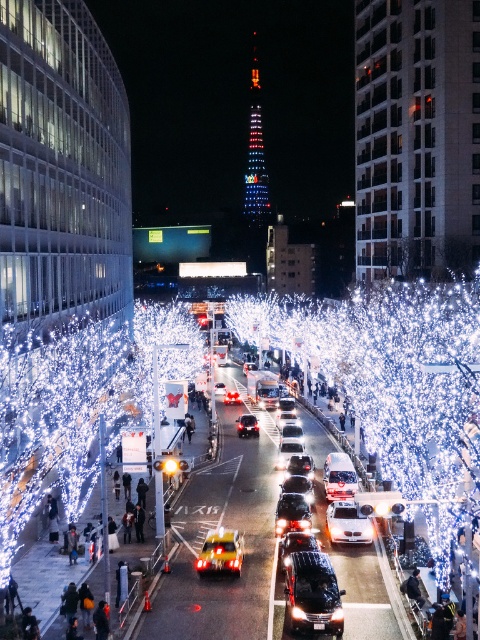
You are a pedestrian standing on the sidewalk and want to cross the street to reach the tower in the background. There is an illuminated wire at center and a glossy metallic car at center in your way. Which object should you move around to avoid the wire?

The illuminated wire at center is positioned on the right side of the glossy metallic car at center. To avoid the wire, you should move around the glossy metallic car at center to the left side.